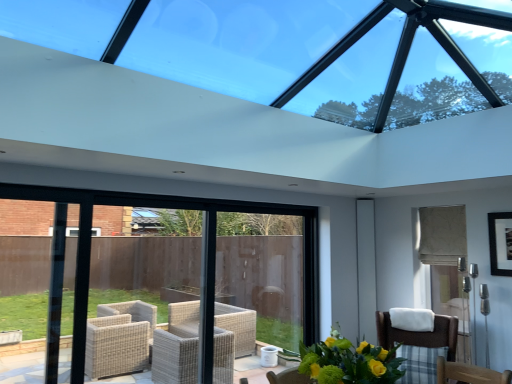
Question: From a real-world perspective, is white glossy screen door at right over transparent glass window at upper center?

Choices:
 (A) no
 (B) yes

Answer: (A)

Question: Does white glossy screen door at right turn towards transparent glass window at upper center?

Choices:
 (A) no
 (B) yes

Answer: (A)

Question: Would you say white glossy screen door at right is outside transparent glass window at upper center?

Choices:
 (A) yes
 (B) no

Answer: (A)

Question: From the image's perspective, is white glossy screen door at right over transparent glass window at upper center?

Choices:
 (A) yes
 (B) no

Answer: (B)

Question: Is white glossy screen door at right shorter than transparent glass window at upper center?

Choices:
 (A) no
 (B) yes

Answer: (A)

Question: Considering the positions of white glossy screen door at right and black matte picture frame at upper right in the image, is white glossy screen door at right taller or shorter than black matte picture frame at upper right?

Choices:
 (A) short
 (B) tall

Answer: (B)

Question: In the image, is white glossy screen door at right on the left side or the right side of black matte picture frame at upper right?

Choices:
 (A) right
 (B) left

Answer: (B)

Question: In terms of size, does white glossy screen door at right appear bigger or smaller than black matte picture frame at upper right?

Choices:
 (A) small
 (B) big

Answer: (B)

Question: From the image's perspective, is white glossy screen door at right located above or below black matte picture frame at upper right?

Choices:
 (A) below
 (B) above

Answer: (A)

Question: Is brown woven chair at lower right situated inside yellow-green bouquet at lower center or outside?

Choices:
 (A) inside
 (B) outside

Answer: (B)

Question: Is point (419, 364) closer or farther from the camera than point (342, 374)?

Choices:
 (A) farther
 (B) closer

Answer: (A)

Question: Is brown woven chair at lower right bigger or smaller than yellow-green bouquet at lower center?

Choices:
 (A) small
 (B) big

Answer: (B)

Question: Would you say brown woven chair at lower right is to the left or to the right of yellow-green bouquet at lower center in the picture?

Choices:
 (A) left
 (B) right

Answer: (B)

Question: In terms of size, does yellow-green bouquet at lower center appear bigger or smaller than black matte picture frame at upper right?

Choices:
 (A) big
 (B) small

Answer: (A)

Question: Is yellow-green bouquet at lower center in front of or behind black matte picture frame at upper right in the image?

Choices:
 (A) behind
 (B) front

Answer: (B)